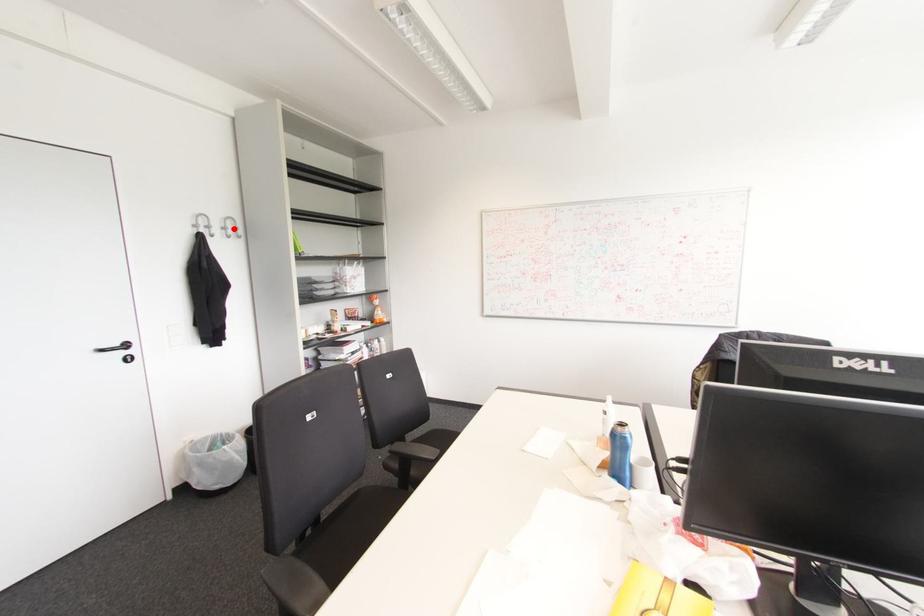
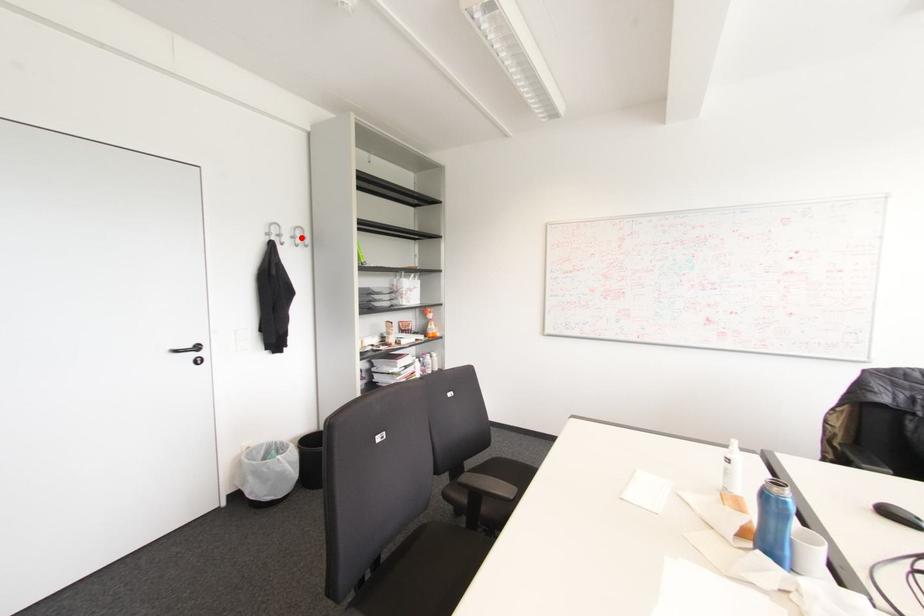
I am providing you with two images of the same scene from different viewpoints. A red point is marked on the first image and another point is marked on the second image. Is the marked point in image1 the same physical position as the marked point in image2?

Yes